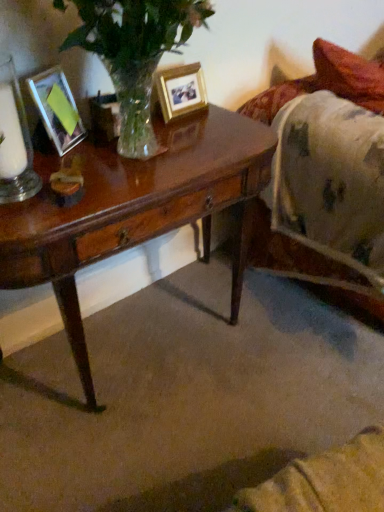
The image size is (384, 512). In order to click on vacant area that lies to the right of white wax candle at left in this screenshot , I will do `click(64, 164)`.